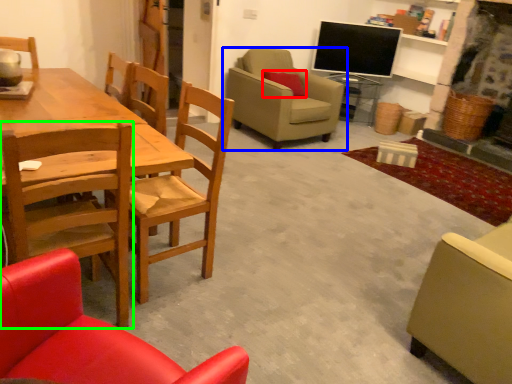
Question: Estimate the real-world distances between objects in this image. Which object is farther from pillow (highlighted by a red box), chair (highlighted by a blue box) or chair (highlighted by a green box)?

Choices:
 (A) chair
 (B) chair

Answer: (B)